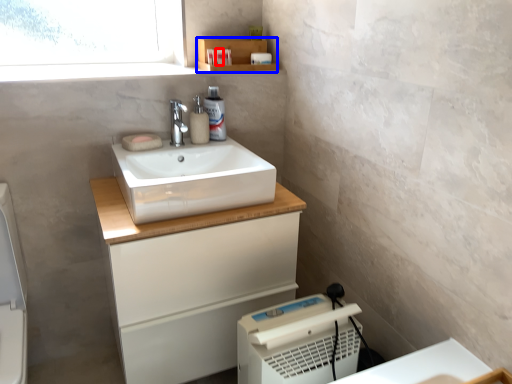
Question: Which point is closer to the camera, toiletry (highlighted by a red box) or shelf (highlighted by a blue box)?

Choices:
 (A) toiletry
 (B) shelf

Answer: (B)